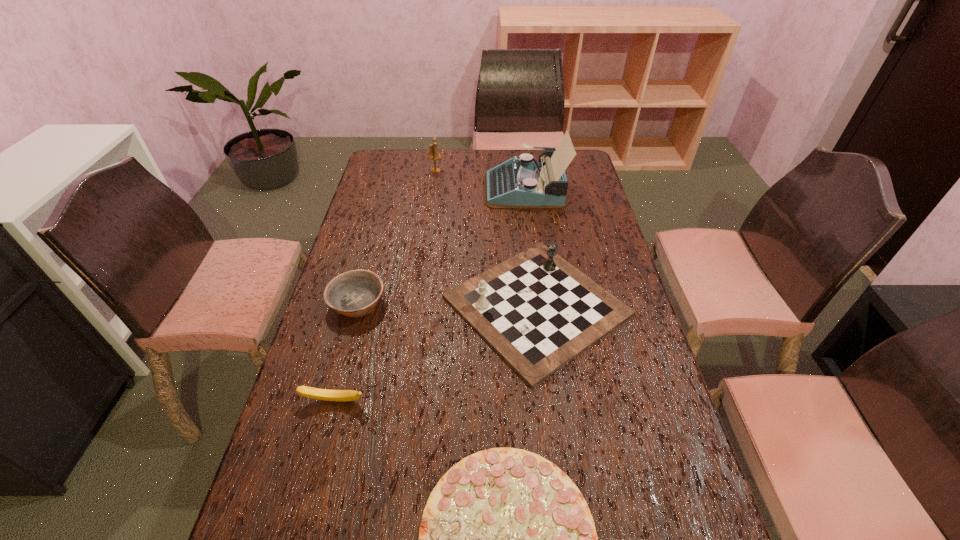
This screenshot has width=960, height=540. What are the coordinates of `vacant space at the far edge` in the screenshot? It's located at (503, 152).

In the image, there is a desktop. Identify the location of vacant area at the left edge. The width and height of the screenshot is (960, 540). (358, 386).

The image size is (960, 540). Find the location of `vacant space at the right edge of the desktop`. vacant space at the right edge of the desktop is located at coordinates (684, 449).

Locate an element on the screen. blank region between the candle holder and the third tallest object is located at coordinates (486, 238).

This screenshot has height=540, width=960. Identify the location of vacant region between the banana and the typewriter. (429, 295).

You are a GUI agent. You are given a task and a screenshot of the screen. Output one action in this format:
    pyautogui.click(x=<x>, y=<y>)
    Task: Click on the unoccupied position between the second nearest object and the bowl
    Image resolution: width=960 pixels, height=540 pixels.
    Given the screenshot: What is the action you would take?
    pyautogui.click(x=346, y=352)

The image size is (960, 540). What are the coordinates of `vacant area between the typewriter and the bowl` in the screenshot? It's located at (441, 246).

Locate an element on the screen. vacant space that is in between the banana and the bowl is located at coordinates pos(346,352).

Locate an element on the screen. vacant area that lies between the typewriter and the banana is located at coordinates (429, 295).

Where is `object that ranks as the closest to the nearest object`? object that ranks as the closest to the nearest object is located at coordinates (538, 312).